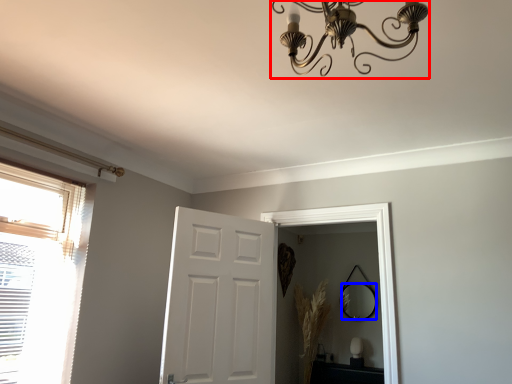
Question: Which point is closer to the camera, light fixture (highlighted by a red box) or mirror (highlighted by a blue box)?

Choices:
 (A) light fixture
 (B) mirror

Answer: (A)